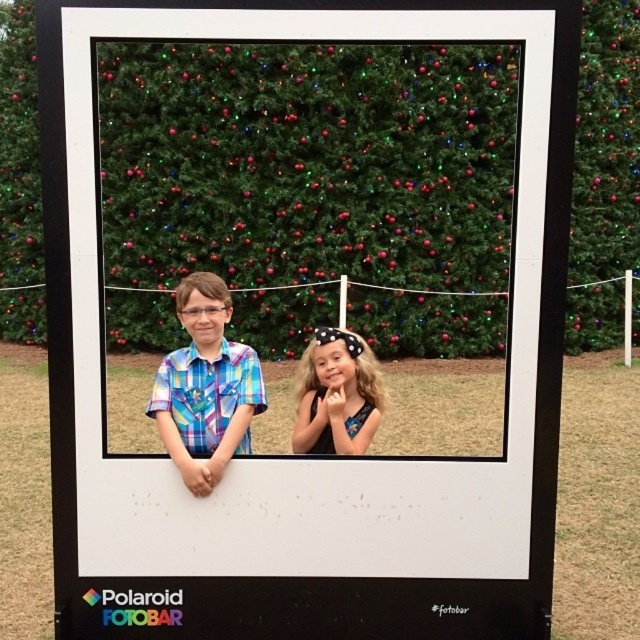
Which is above, plaid fabric shirt at center or blonde hair at center?

plaid fabric shirt at center is above.

Can you confirm if plaid fabric shirt at center is positioned to the left of blonde hair at center?

Indeed, plaid fabric shirt at center is positioned on the left side of blonde hair at center.

The image size is (640, 640). I want to click on plaid fabric shirt at center, so click(205, 387).

You are a GUI agent. You are given a task and a screenshot of the screen. Output one action in this format:
    pyautogui.click(x=<x>, y=<y>)
    Task: Click on the plaid fabric shirt at center
    Image resolution: width=640 pixels, height=640 pixels.
    Given the screenshot: What is the action you would take?
    pyautogui.click(x=205, y=387)